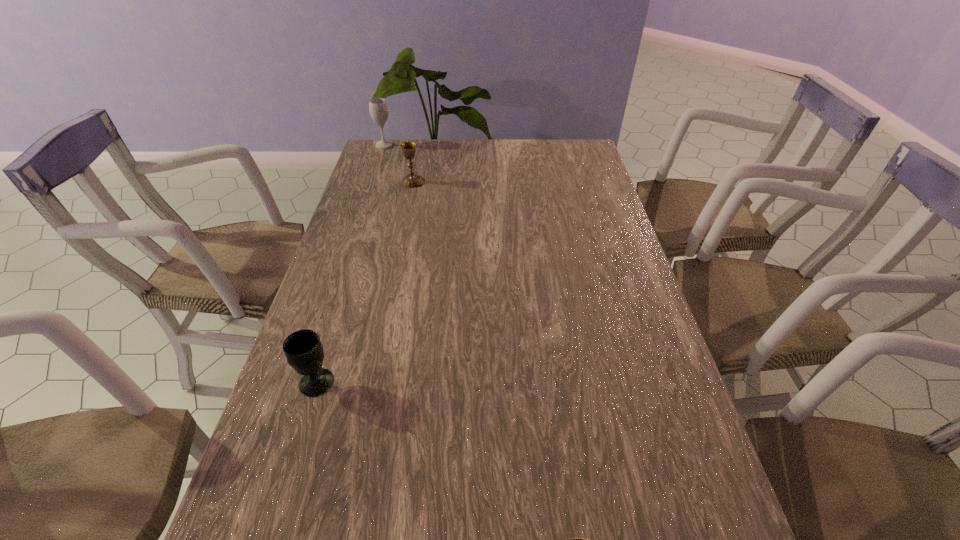
Find the location of a particular element. The height and width of the screenshot is (540, 960). free spot between the farthest object and the leftmost chalice is located at coordinates (350, 264).

At what (x,y) coordinates should I click in order to perform the action: click on vacant area between the wineglass and the leftmost chalice. Please return your answer as a coordinate pair (x, y). The width and height of the screenshot is (960, 540). Looking at the image, I should click on click(350, 264).

Point out which object is positioned as the second nearest to the second nearest chalice. Please provide its 2D coordinates. Your answer should be formatted as a tuple, i.e. [(x, y)], where the tuple contains the x and y coordinates of a point satisfying the conditions above.

[(413, 180)]

Where is `object that is the second closest one to the rightmost chalice`? This screenshot has width=960, height=540. object that is the second closest one to the rightmost chalice is located at coordinates (413, 180).

Locate an element on the screen. The width and height of the screenshot is (960, 540). chalice object that ranks as the second closest to the third object from left to right is located at coordinates (576, 539).

This screenshot has height=540, width=960. I want to click on the second closest chalice to the rightmost object, so click(x=413, y=180).